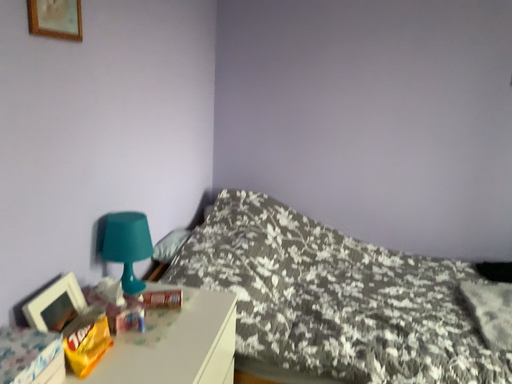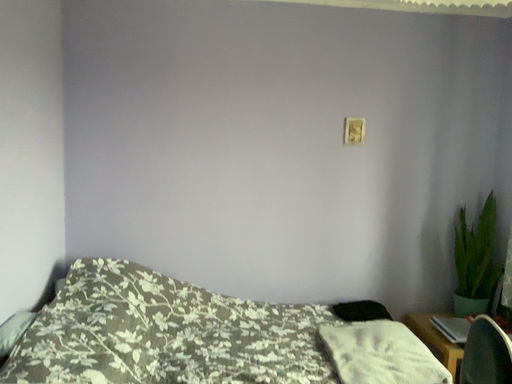
Question: Which way did the camera rotate in the video?

Choices:
 (A) rotated downward
 (B) rotated upward

Answer: (B)